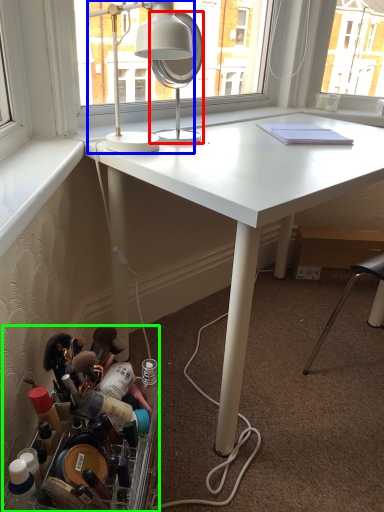
Question: Which object is positioned closest to mirror (highlighted by a red box)? Select from lamp (highlighted by a blue box) and toiletry (highlighted by a green box).

Choices:
 (A) lamp
 (B) toiletry

Answer: (A)